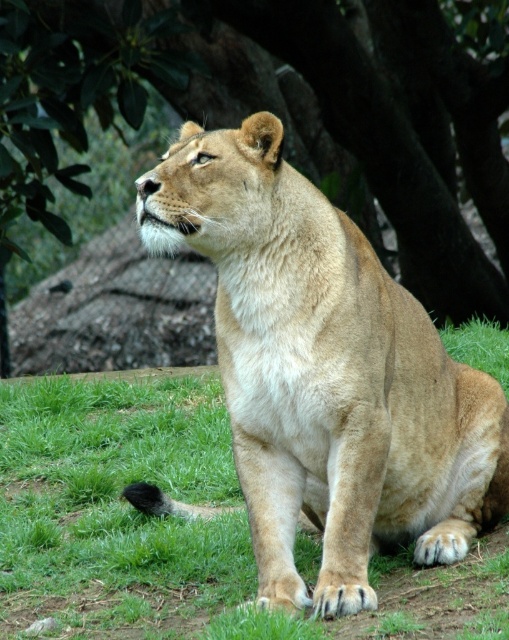
Question: Which object is closer to the camera taking this photo?

Choices:
 (A) green grass at center
 (B) green leafy tree at upper left

Answer: (A)

Question: Can you confirm if green leafy tree at upper left is positioned to the left of green grass at center?

Choices:
 (A) yes
 (B) no

Answer: (B)

Question: Where is golden fur lion at center located in relation to green grass at center in the image?

Choices:
 (A) left
 (B) right

Answer: (B)

Question: Is green leafy tree at upper left bigger than green grass at center?

Choices:
 (A) yes
 (B) no

Answer: (A)

Question: Which object is closer to the camera taking this photo?

Choices:
 (A) green leafy tree at upper left
 (B) golden fur lion at center

Answer: (B)

Question: Which of the following is the farthest from the observer?

Choices:
 (A) (97, 513)
 (B) (138, 6)

Answer: (B)